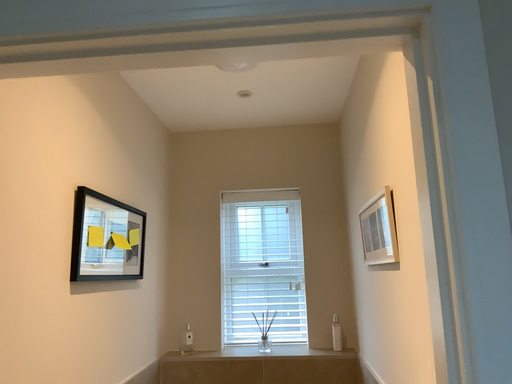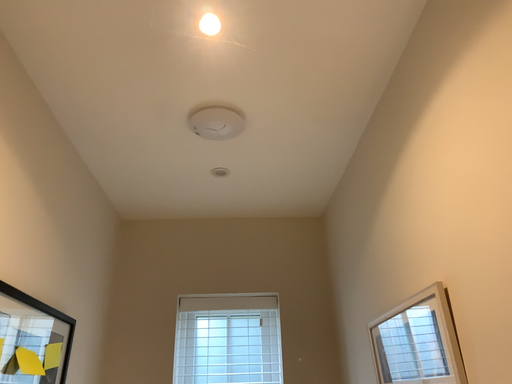
Question: Which way did the camera rotate in the video?

Choices:
 (A) rotated upward
 (B) rotated downward

Answer: (A)